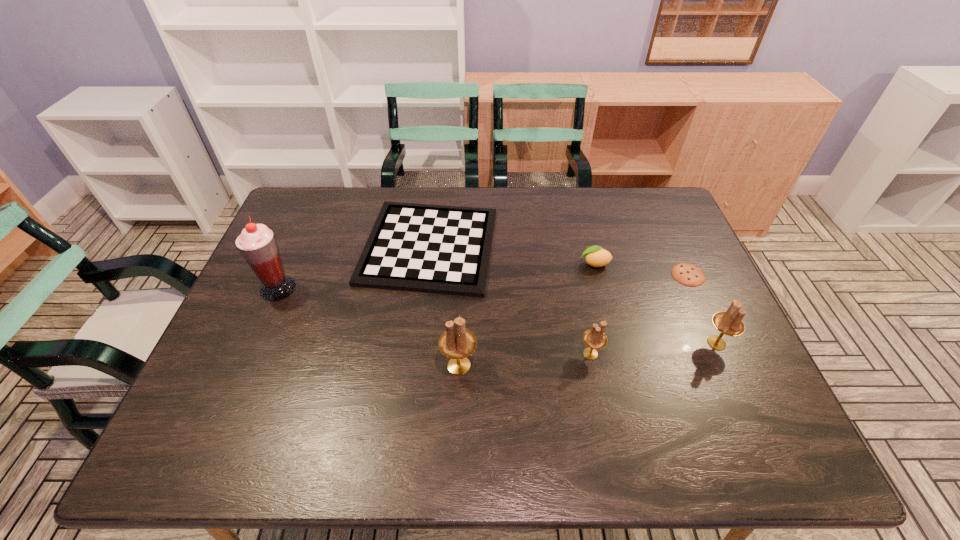
The height and width of the screenshot is (540, 960). I want to click on the leftmost candle holder, so click(x=457, y=342).

Where is `the second candle holder from right to left`? The height and width of the screenshot is (540, 960). the second candle holder from right to left is located at coordinates (594, 338).

What are the coordinates of `the shortest candle holder` in the screenshot? It's located at (594, 338).

The width and height of the screenshot is (960, 540). What are the coordinates of `the rightmost candle holder` in the screenshot? It's located at (730, 323).

Where is `the second shortest candle holder`? This screenshot has height=540, width=960. the second shortest candle holder is located at coordinates (730, 323).

This screenshot has height=540, width=960. I want to click on the sixth tallest object, so click(440, 249).

The height and width of the screenshot is (540, 960). I want to click on lemon, so click(595, 256).

Locate an element on the screen. The height and width of the screenshot is (540, 960). cookie is located at coordinates (687, 274).

Find the location of a particular element. This screenshot has width=960, height=540. the leftmost object is located at coordinates (257, 244).

You are a GUI agent. You are given a task and a screenshot of the screen. Output one action in this format:
    pyautogui.click(x=<x>, y=<y>)
    Task: Click on the vacant area situated 0.240m on the back of the tallest candle holder
    This screenshot has height=540, width=960.
    Given the screenshot: What is the action you would take?
    pyautogui.click(x=462, y=281)